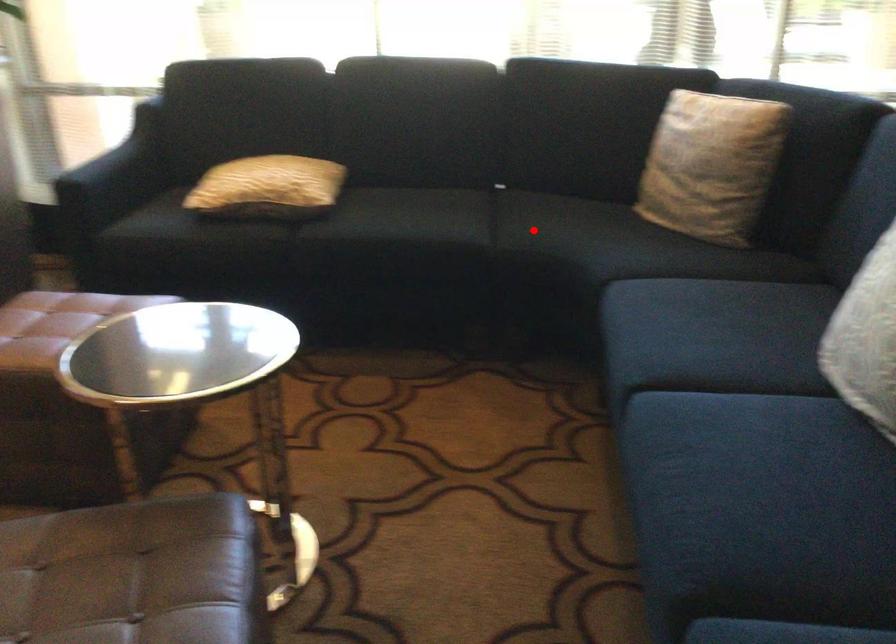
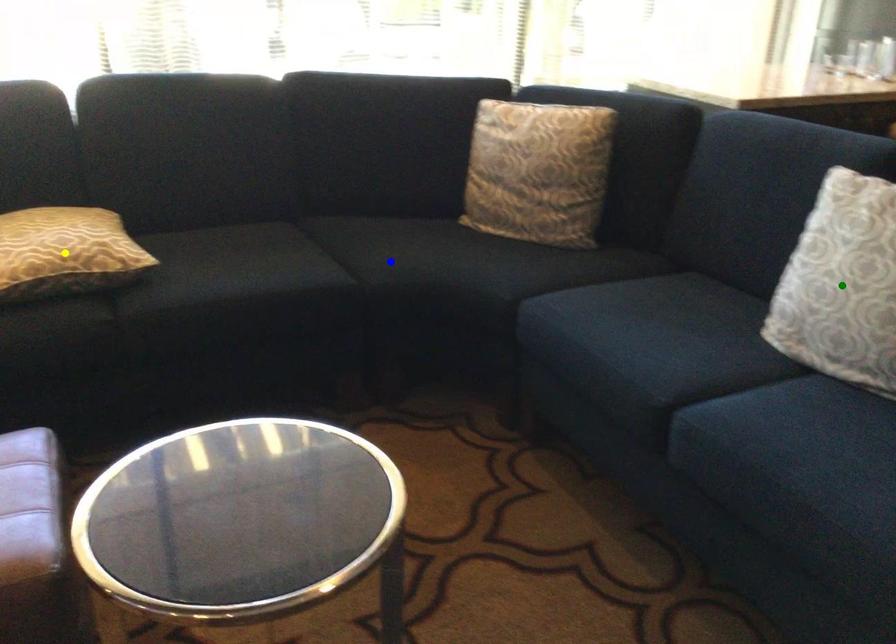
Question: I am providing you with two images of the same scene from different viewpoints. A red point is marked on the first image. You are given multiple points on the second image. Which point in image 2 represents the same 3d spot as the red point in image 1?

Choices:
 (A) blue point
 (B) yellow point
 (C) green point

Answer: (A)